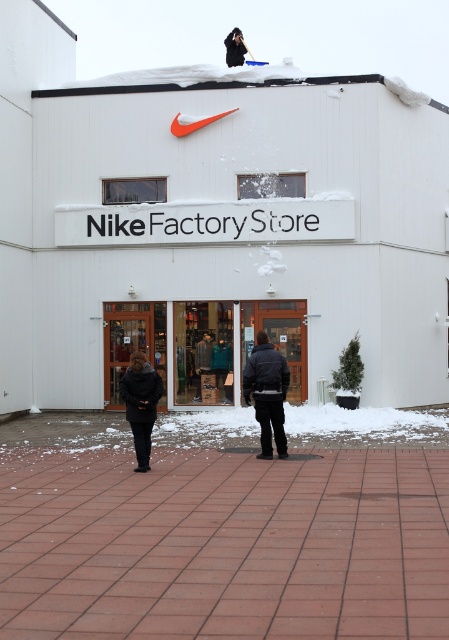
Question: Can you confirm if matte glass storefront at center is thinner than black fuzzy coat at center?

Choices:
 (A) yes
 (B) no

Answer: (B)

Question: Can you confirm if dark gray fabric coat at center is positioned above black fuzzy coat at center?

Choices:
 (A) yes
 (B) no

Answer: (A)

Question: Is matte glass storefront at center behind black fuzzy coat at center?

Choices:
 (A) yes
 (B) no

Answer: (A)

Question: Among these objects, which one is nearest to the camera?

Choices:
 (A) dark gray fabric jacket at center
 (B) dark gray fabric coat at center
 (C) white matte nike factory store at center
 (D) dark blue fabric jacket at center

Answer: (D)

Question: Which point is farther to the camera?

Choices:
 (A) white matte nike factory store at center
 (B) dark gray fabric coat at center

Answer: (A)

Question: Estimate the real-world distances between objects in this image. Which object is farther from the black fuzzy coat at center?

Choices:
 (A) dark blue fabric jacket at center
 (B) dark gray fabric coat at center
 (C) dark gray fabric jacket at center

Answer: (C)